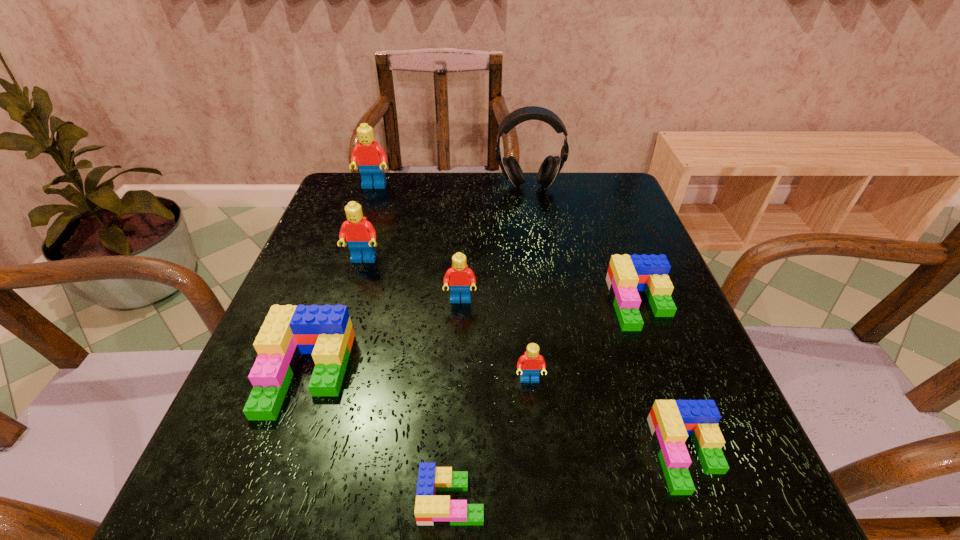
Locate an element on the screen. the biggest green Lego is located at coordinates (326, 332).

Locate an element on the screen. This screenshot has height=540, width=960. the sixth tallest Lego is located at coordinates (627, 274).

You are a GUI agent. You are given a task and a screenshot of the screen. Output one action in this format:
    pyautogui.click(x=<x>, y=<y>)
    Task: Click on the third shortest object
    The width and height of the screenshot is (960, 540).
    Given the screenshot: What is the action you would take?
    pyautogui.click(x=627, y=274)

Identify the location of the eighth tallest object. (671, 422).

You are a GUI agent. You are given a task and a screenshot of the screen. Output one action in this format:
    pyautogui.click(x=<x>, y=<y>)
    Task: Click on the seventh tallest Lego
    
    Given the screenshot: What is the action you would take?
    pyautogui.click(x=671, y=422)

Identify the location of the smallest green Lego. The width and height of the screenshot is (960, 540). (430, 509).

Locate an element on the screen. The height and width of the screenshot is (540, 960). the shortest object is located at coordinates (430, 509).

At what (x,y) coordinates should I click in order to perform the action: click on vacant space located 0.140m on the ear cups of the earphone. Please return your answer as a coordinate pair (x, y). The image size is (960, 540). Looking at the image, I should click on (535, 224).

The height and width of the screenshot is (540, 960). I want to click on vacant position located 0.150m on the face of the tallest Lego, so click(361, 223).

Identify the location of free space located 0.240m on the face of the seventh shortest Lego. (335, 352).